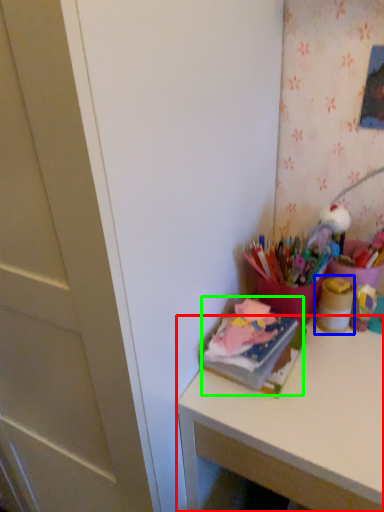
Question: Which object is the closest to the desk (highlighted by a red box)? Choose among these: stationery (highlighted by a blue box) or book (highlighted by a green box).

Choices:
 (A) stationery
 (B) book

Answer: (B)